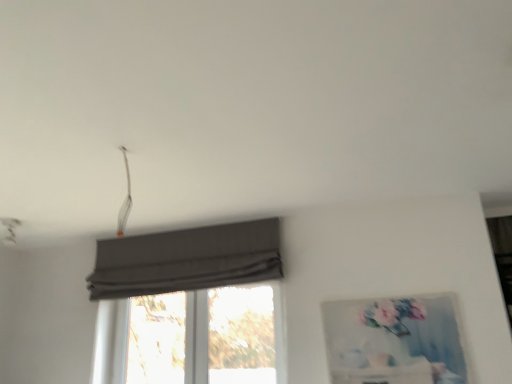
Question: Is dark gray fabric curtain at center bigger or smaller than transparent glass window at center?

Choices:
 (A) big
 (B) small

Answer: (A)

Question: Is dark gray fabric curtain at center in front of or behind transparent glass window at center in the image?

Choices:
 (A) front
 (B) behind

Answer: (A)

Question: Considering the real-world distances, which object is closest to the dark gray fabric curtain at center?

Choices:
 (A) matte gray picture frame at right
 (B) transparent glass window at center

Answer: (B)

Question: Which object is positioned closest to the transparent glass window at center?

Choices:
 (A) dark gray fabric curtain at center
 (B) matte gray picture frame at right

Answer: (A)